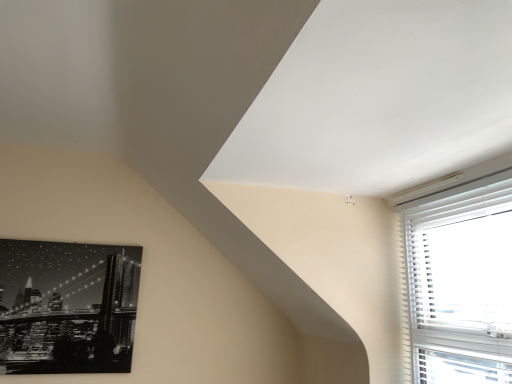
What do you see at coordinates (67, 306) in the screenshot? This screenshot has height=384, width=512. I see `black glossy canvas print at lower left` at bounding box center [67, 306].

Locate an element on the screen. Image resolution: width=512 pixels, height=384 pixels. black glossy canvas print at lower left is located at coordinates (67, 306).

Where is `black glossy canvas print at lower left`? The image size is (512, 384). black glossy canvas print at lower left is located at coordinates (67, 306).